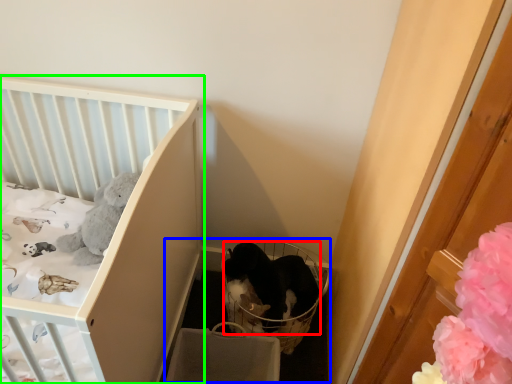
Question: Which object is positioned farthest from cat (highlighted by a red box)? Select from baby carriage (highlighted by a blue box) and infant bed (highlighted by a green box).

Choices:
 (A) baby carriage
 (B) infant bed

Answer: (B)